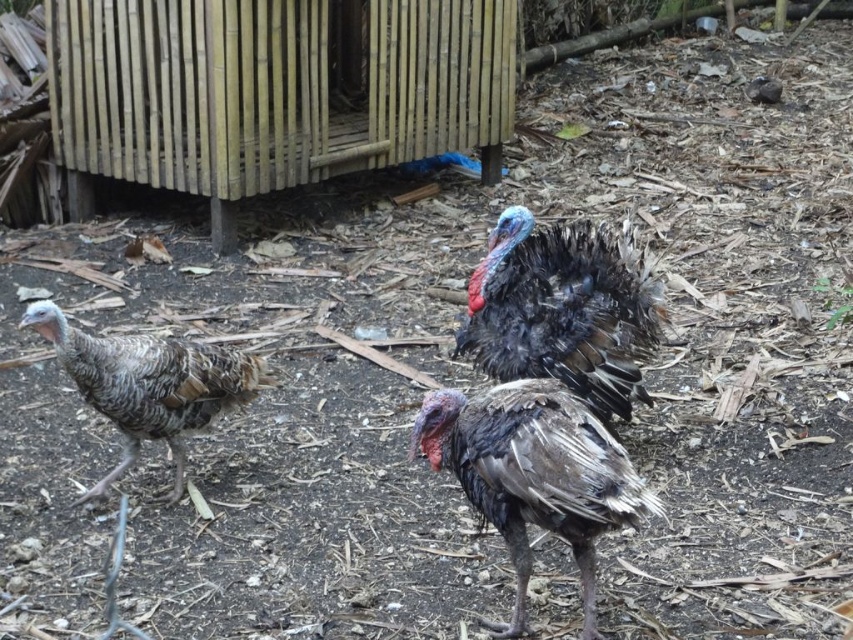
Does dark feathered turkey at center have a smaller size compared to gray matte turkey at center?

Incorrect, dark feathered turkey at center is not smaller in size than gray matte turkey at center.

Who is more distant from viewer, (505, 365) or (498, 499)?

The point (505, 365) is behind.

Identify the location of dark feathered turkey at center. (563, 308).

In the scene shown: Can you confirm if gray matte turkey at center is shorter than gray speckled turkey at left?

No.

In the scene shown: Is gray matte turkey at center positioned before gray speckled turkey at left?

Yes.

Measure the distance between gray matte turkey at center and camera.

gray matte turkey at center is 2.46 meters from camera.

At what (x,y) coordinates should I click in order to perform the action: click on gray matte turkey at center. Please return your answer as a coordinate pair (x, y). This screenshot has width=853, height=640. Looking at the image, I should click on (534, 474).

Between point (524, 323) and point (105, 369), which one is positioned in front?

Point (105, 369)

Does point (579, 380) come farther from viewer compared to point (45, 336)?

Yes, point (579, 380) is behind point (45, 336).

Locate an element on the screen. The width and height of the screenshot is (853, 640). dark feathered turkey at center is located at coordinates (563, 308).